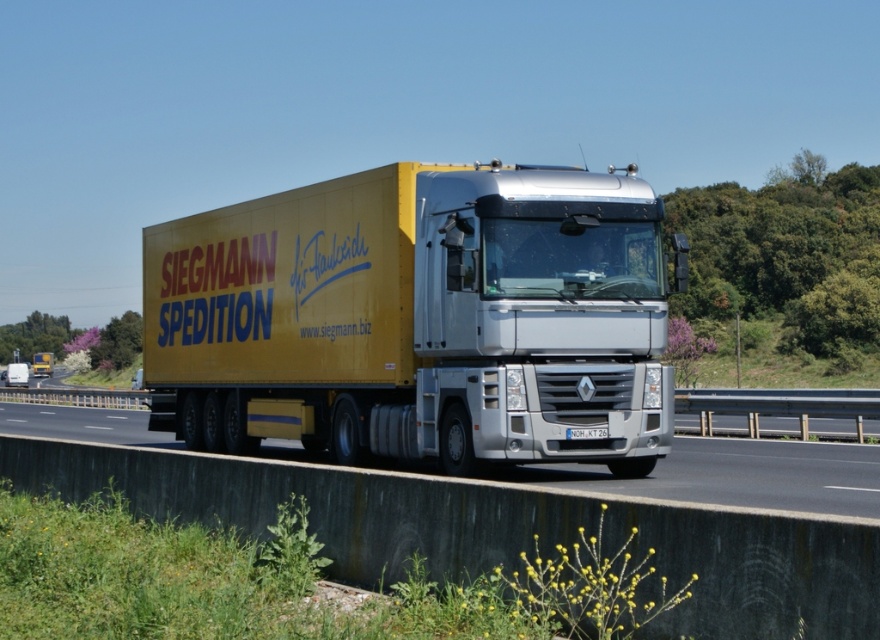
Question: Which point is farther to the camera?

Choices:
 (A) (801, 448)
 (B) (622, 451)

Answer: (A)

Question: Does yellow matte trailer truck at center have a smaller size compared to black asphalt highway at center?

Choices:
 (A) yes
 (B) no

Answer: (A)

Question: Observing the image, what is the correct spatial positioning of yellow matte trailer truck at center in reference to black asphalt highway at center?

Choices:
 (A) left
 (B) right

Answer: (B)

Question: Does yellow matte trailer truck at center have a greater width compared to black asphalt highway at center?

Choices:
 (A) no
 (B) yes

Answer: (A)